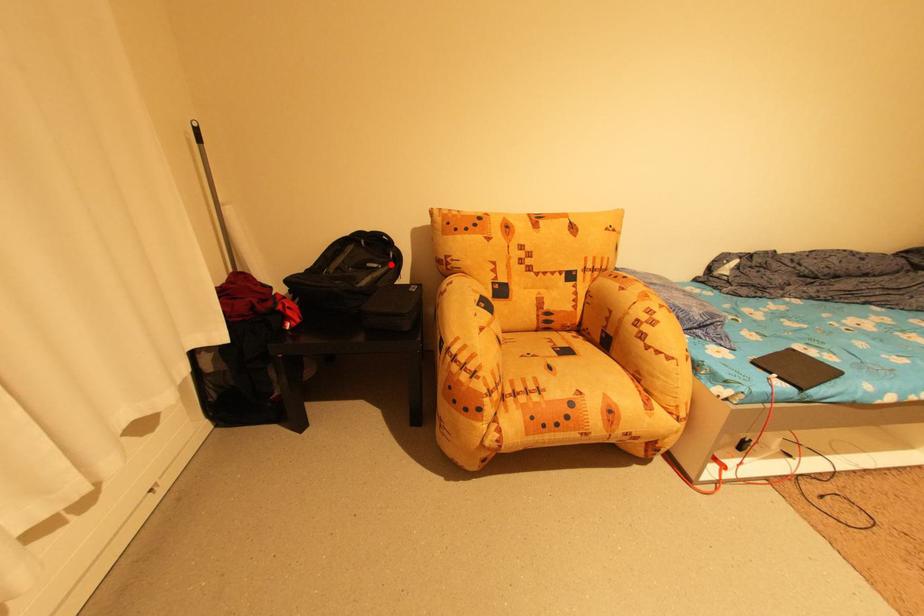
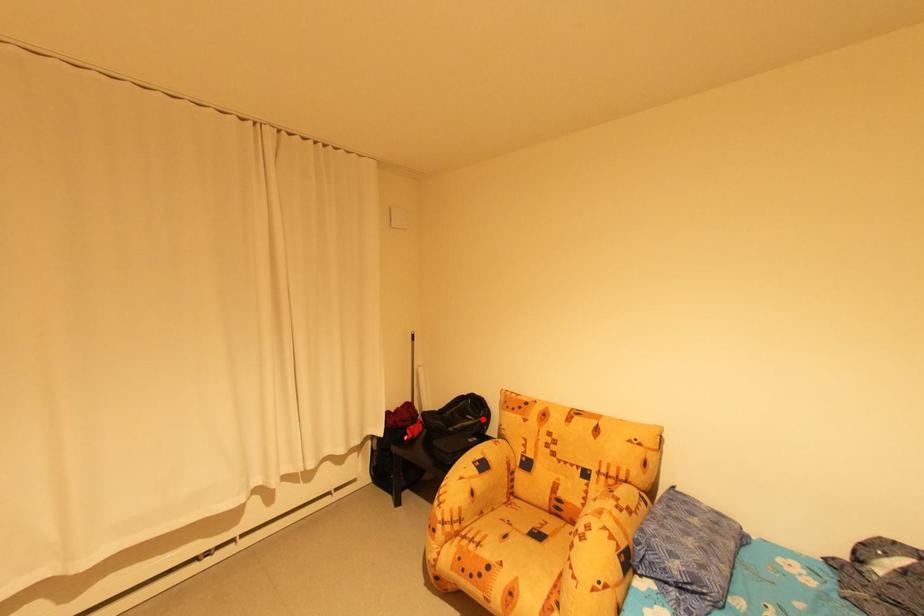
I am providing you with two images of the same scene from different viewpoints. A red point is marked on the first image and another point is marked on the second image. Does the point marked in image1 correspond to the same location as the one in image2?

Yes